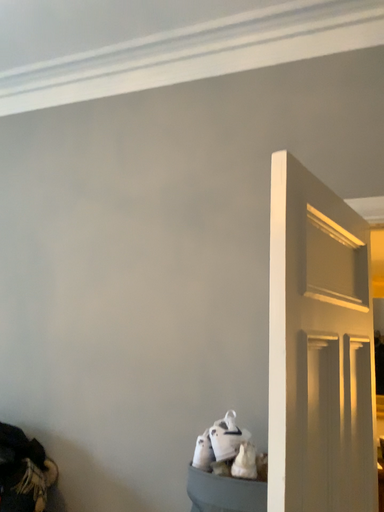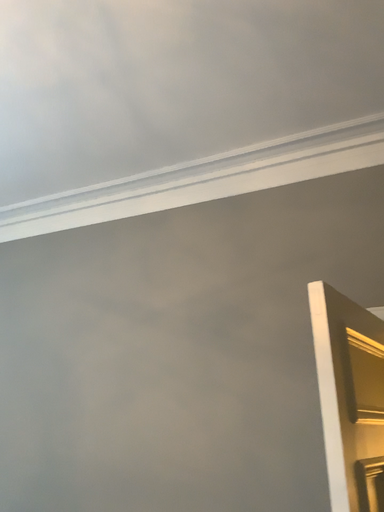
Question: Which way did the camera rotate in the video?

Choices:
 (A) rotated downward
 (B) rotated upward

Answer: (B)